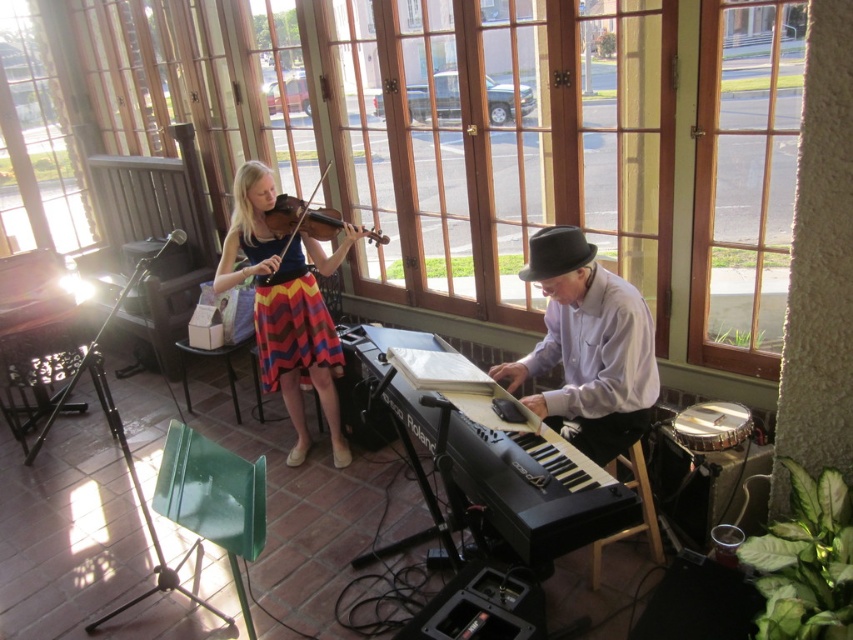
Question: Considering the relative positions of chevron-patterned fabric dress at center and wooden violin at center in the image provided, where is chevron-patterned fabric dress at center located with respect to wooden violin at center?

Choices:
 (A) above
 (B) below

Answer: (B)

Question: Is the position of chevron-patterned fabric dress at center less distant than that of wooden violin at center?

Choices:
 (A) no
 (B) yes

Answer: (A)

Question: Which object appears farthest from the camera in this image?

Choices:
 (A) multicolored striped skirt at center
 (B) wooden violin at center

Answer: (B)

Question: Which point appears closest to the camera in this image?

Choices:
 (A) click(x=608, y=419)
 (B) click(x=311, y=196)
 (C) click(x=331, y=356)
 (D) click(x=497, y=449)

Answer: (D)

Question: Which is nearer to the multicolored striped skirt at center?

Choices:
 (A) white matte keyboard at center
 (B) chevron-patterned fabric dress at center

Answer: (B)

Question: Does black plastic keyboard at center have a greater width compared to multicolored striped skirt at center?

Choices:
 (A) no
 (B) yes

Answer: (B)